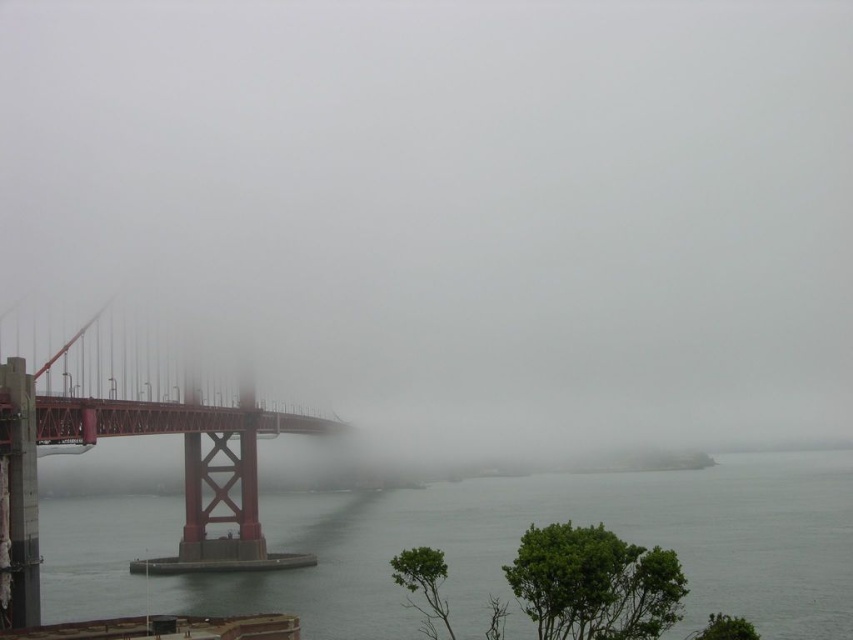
Question: Which point is closer to the camera taking this photo?

Choices:
 (A) (189, 524)
 (B) (468, 497)

Answer: (A)

Question: Which object is closer to the camera taking this photo?

Choices:
 (A) clear water at lower left
 (B) matte red suspension bridge at left

Answer: (A)

Question: Can you confirm if clear water at lower left is thinner than matte red suspension bridge at left?

Choices:
 (A) yes
 (B) no

Answer: (B)

Question: Does clear water at lower left have a smaller size compared to matte red suspension bridge at left?

Choices:
 (A) yes
 (B) no

Answer: (B)

Question: Is clear water at lower left in front of matte red suspension bridge at left?

Choices:
 (A) no
 (B) yes

Answer: (B)

Question: Which object is closer to the camera taking this photo?

Choices:
 (A) clear water at lower left
 (B) matte red suspension bridge at left

Answer: (A)